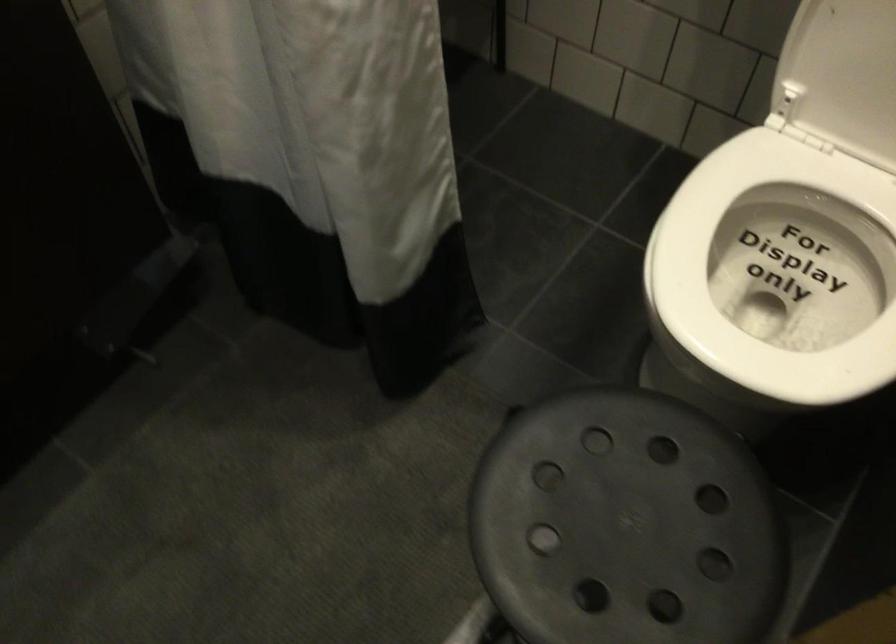
Describe the element at coordinates (780, 268) in the screenshot. I see `the white toilet seat` at that location.